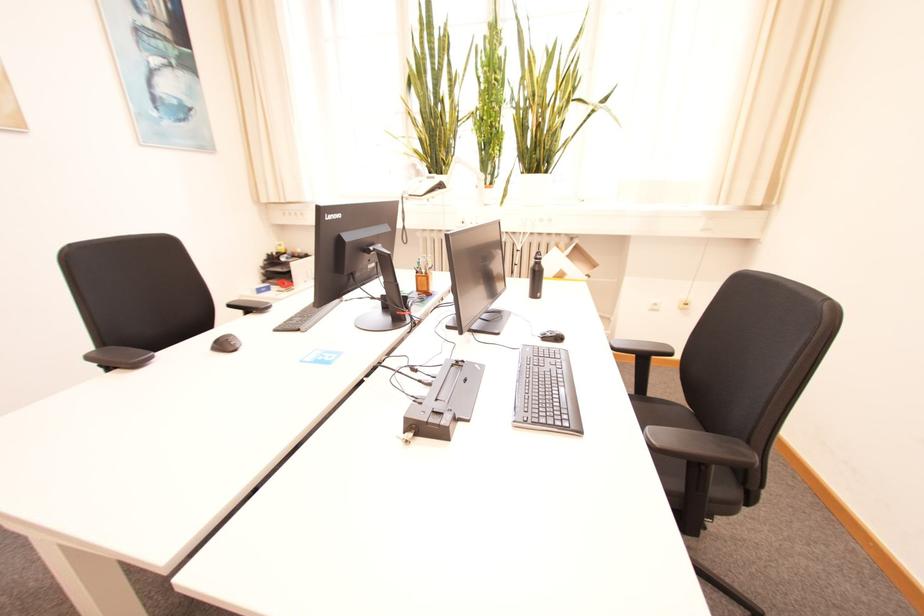
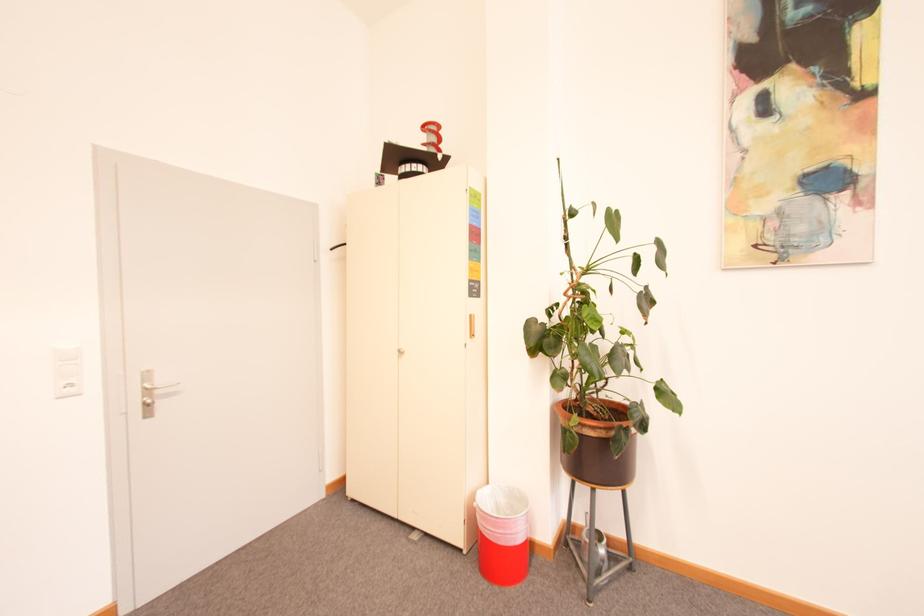
Question: The images are taken continuously from a first-person perspective. In which direction is your viewpoint rotating?

Choices:
 (A) Left
 (B) Right
 (C) Up
 (D) Down

Answer: (A)